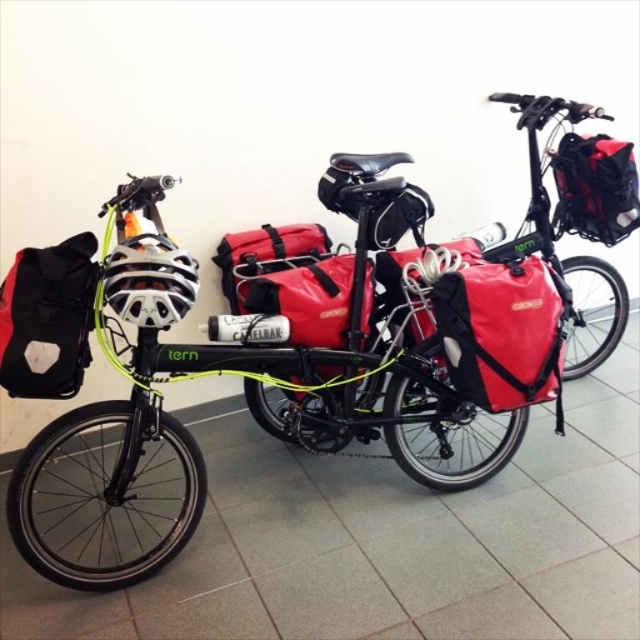
Question: Estimate the real-world distances between objects in this image. Which object is farther from the black fabric backpack at left?

Choices:
 (A) matte black bicycle at left
 (B) matte black bag at center
 (C) red fabric bag at center
 (D) matte black bag at upper right

Answer: (D)

Question: Is matte black bag at upper right closer to camera compared to red fabric bag at center?

Choices:
 (A) yes
 (B) no

Answer: (B)

Question: Does black fabric backpack at left appear on the right side of matte black bag at upper right?

Choices:
 (A) no
 (B) yes

Answer: (A)

Question: Is matte black bicycle at left closer to the viewer compared to black fabric backpack at left?

Choices:
 (A) no
 (B) yes

Answer: (B)

Question: Which point appears farthest from the camera in this image?

Choices:
 (A) (22, 289)
 (B) (109, 420)
 (C) (246, 252)
 (D) (628, 205)

Answer: (D)

Question: Which point is farther to the camera?

Choices:
 (A) matte black bag at upper right
 (B) red fabric bag at center
 (C) matte black bicycle at left

Answer: (A)